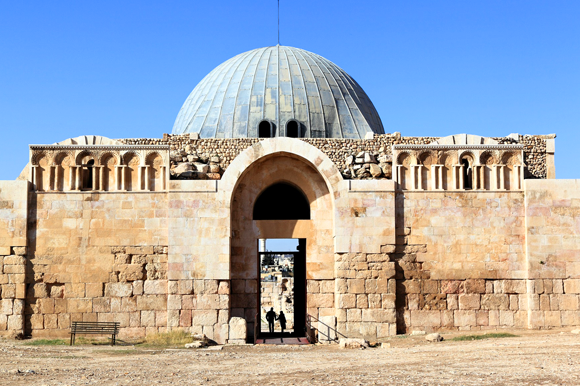
Where is `doorway`? The width and height of the screenshot is (580, 386). doorway is located at coordinates (299, 284).